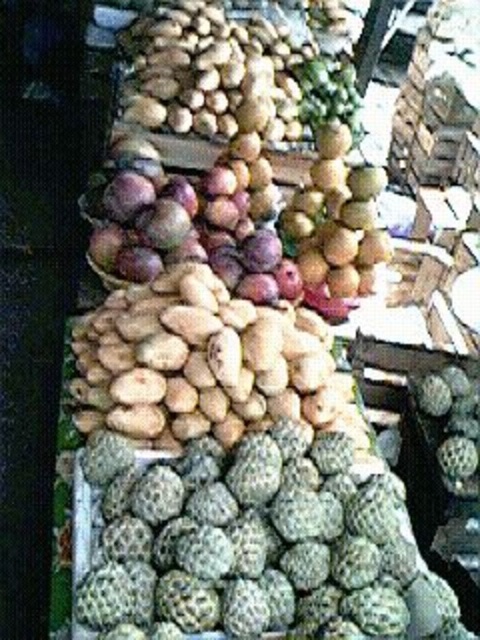
Is green rough textured fruit at lower center shorter than shiny purple plums at center?

Yes, green rough textured fruit at lower center is shorter than shiny purple plums at center.

Which is behind, point (308, 620) or point (312, 198)?

The point (312, 198) is behind.

Find the location of a particular element. The height and width of the screenshot is (640, 480). green rough textured fruit at lower center is located at coordinates (254, 545).

Can you confirm if shiny purple plums at center is wider than smooth brown nuts at center?

Yes.

Does shiny purple plums at center have a lesser width compared to smooth brown nuts at center?

Incorrect, shiny purple plums at center's width is not less than smooth brown nuts at center's.

Is point (170, 116) closer to camera compared to point (360, 227)?

No, (170, 116) is further to viewer.

Locate an element on the screen. The image size is (480, 640). shiny purple plums at center is located at coordinates (240, 164).

Is point (168, 612) in front of point (360, 289)?

Yes, point (168, 612) is closer to viewer.

Is green rough textured fruit at lower center below smooth brown nuts at center?

Indeed, green rough textured fruit at lower center is positioned under smooth brown nuts at center.

Is point (304, 609) more distant than point (365, 243)?

No, (304, 609) is closer to viewer.

The width and height of the screenshot is (480, 640). What are the coordinates of `green rough textured fruit at lower center` in the screenshot? It's located at (254, 545).